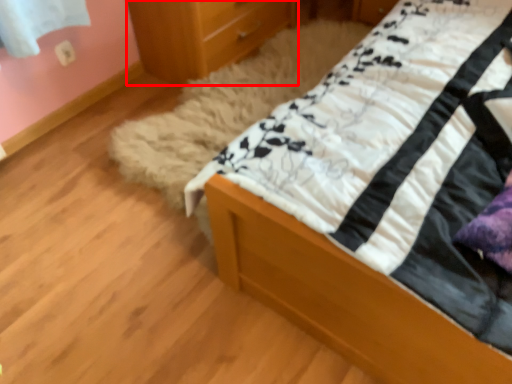
Question: From the image's perspective, considering the relative positions of chest of drawers (annotated by the red box) and bed in the image provided, where is chest of drawers (annotated by the red box) located with respect to the staircase?

Choices:
 (A) below
 (B) above

Answer: (B)